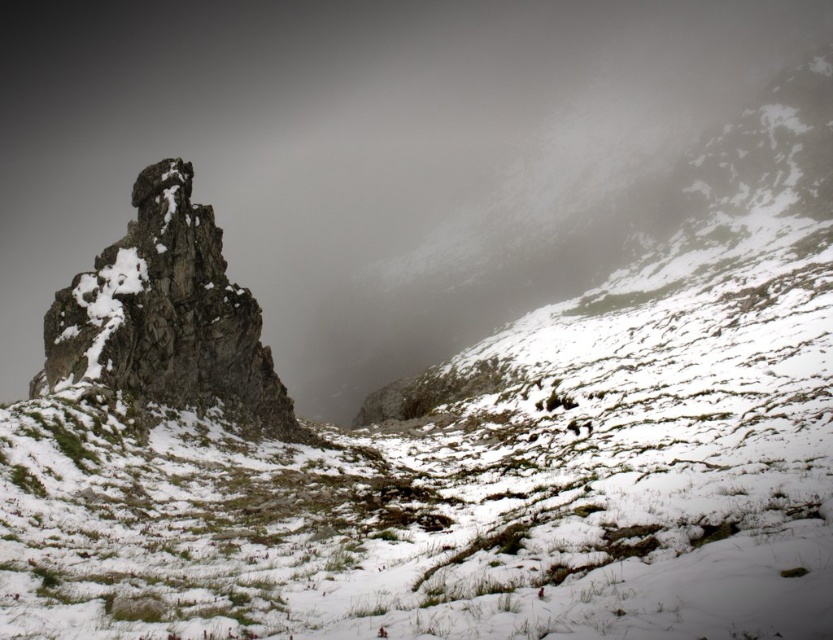
Can you confirm if white foggy cloud at upper center is smaller than rough stone rock at left?

No, white foggy cloud at upper center is not smaller than rough stone rock at left.

Who is shorter, white foggy cloud at upper center or rough stone rock at left?

rough stone rock at left

Between point (323, 243) and point (188, 291), which one is positioned behind?

The point (323, 243) is more distant.

You are a GUI agent. You are given a task and a screenshot of the screen. Output one action in this format:
    pyautogui.click(x=<x>, y=<y>)
    Task: Click on the white foggy cloud at upper center
    This screenshot has height=640, width=833.
    Given the screenshot: What is the action you would take?
    pyautogui.click(x=370, y=154)